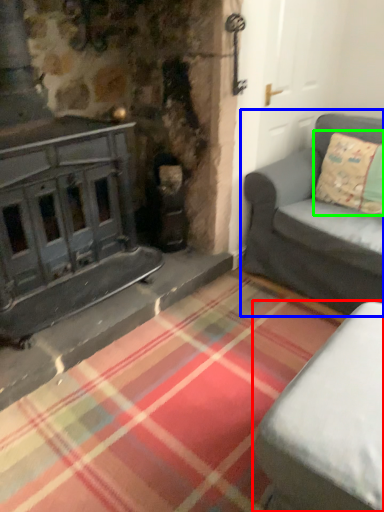
Question: Which object is positioned closest to studio couch (highlighted by a red box)? Select from studio couch (highlighted by a blue box) and pillow (highlighted by a green box).

Choices:
 (A) studio couch
 (B) pillow

Answer: (A)